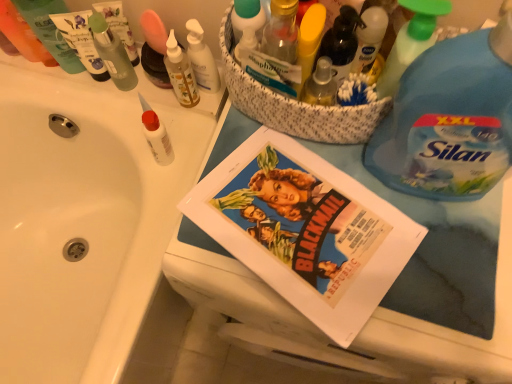
Locate an element on the screen. This screenshot has height=384, width=512. vacant space that's between translucent plastic pump bottle at upper center, the 6th toiletry in the left-to-right sequence, and white matte glue at upper left, the fifth toiletry from the left is located at coordinates (191, 126).